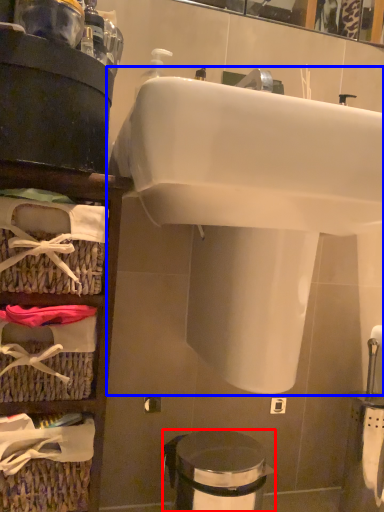
Question: Which of the following is the farthest to the observer, trash bin/can (highlighted by a red box) or sink (highlighted by a blue box)?

Choices:
 (A) trash bin/can
 (B) sink

Answer: (A)